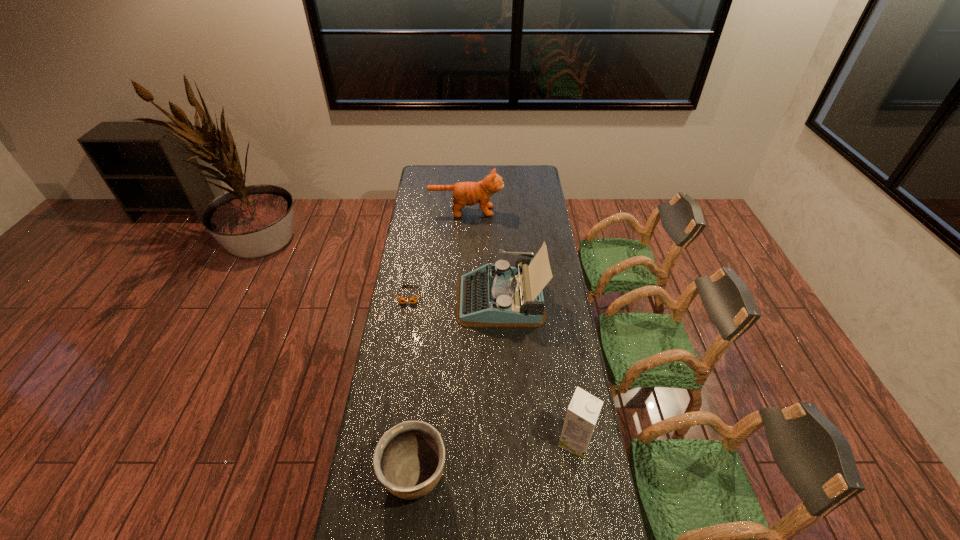
The width and height of the screenshot is (960, 540). What are the coordinates of `vacant area that lies between the typewriter and the shortest object` in the screenshot? It's located at (455, 297).

Identify which object is the nearest to the cat. Please provide its 2D coordinates. Your answer should be formatted as a tuple, i.e. [(x, y)], where the tuple contains the x and y coordinates of a point satisfying the conditions above.

[(494, 295)]

Point out which object is positioned as the second nearest to the fourth tallest object. Please provide its 2D coordinates. Your answer should be formatted as a tuple, i.e. [(x, y)], where the tuple contains the x and y coordinates of a point satisfying the conditions above.

[(494, 295)]

Where is `free point that satisfies the following two spatial constraints: 1. on the typing side of the carton; 2. on the left side of the typewriter`? free point that satisfies the following two spatial constraints: 1. on the typing side of the carton; 2. on the left side of the typewriter is located at coordinates (x=507, y=441).

This screenshot has width=960, height=540. In order to click on vacant position in the image that satisfies the following two spatial constraints: 1. on the face of the cat; 2. with the lenses facing forward on the shortest object in this screenshot , I will do `click(463, 295)`.

Locate an element on the screen. This screenshot has width=960, height=540. free location that satisfies the following two spatial constraints: 1. with the lenses facing forward on the carton; 2. on the left side of the shortest object is located at coordinates (386, 441).

Find the location of a particular element. free space that satisfies the following two spatial constraints: 1. on the face of the farthest object; 2. with the lenses facing forward on the shortest object is located at coordinates (463, 295).

Locate an element on the screen. Image resolution: width=960 pixels, height=540 pixels. free space in the image that satisfies the following two spatial constraints: 1. with the lenses facing forward on the shortest object; 2. on the right side of the pottery is located at coordinates (380, 476).

In order to click on vacant space that satisfies the following two spatial constraints: 1. on the typing side of the typewriter; 2. on the right side of the carton in this screenshot , I will do `click(507, 441)`.

The height and width of the screenshot is (540, 960). I want to click on vacant space that satisfies the following two spatial constraints: 1. on the face of the carton; 2. on the right side of the cat, so click(x=457, y=441).